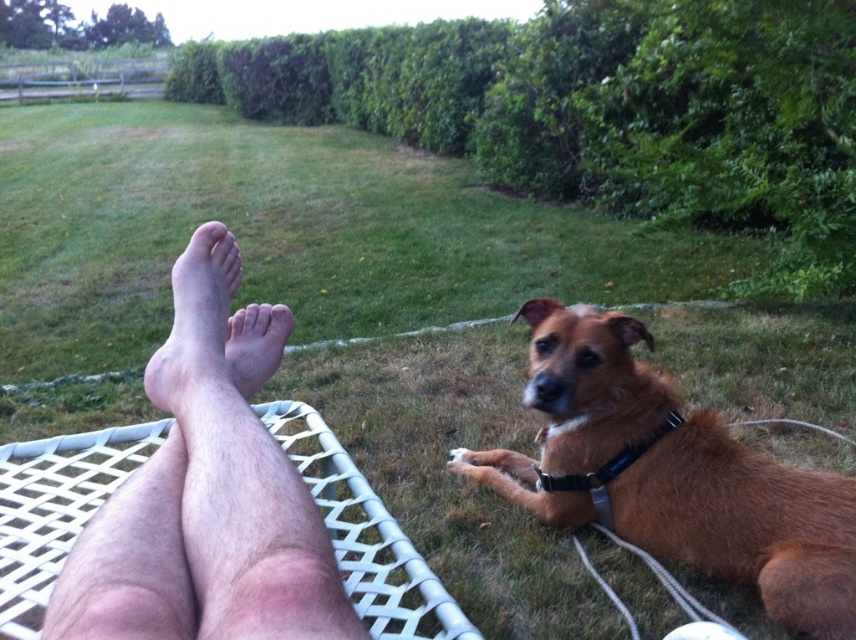
Question: Is pale skin at center to the right of smooth skin foot at center from the viewer's perspective?

Choices:
 (A) yes
 (B) no

Answer: (B)

Question: Does hair-covered skin at center come in front of pale skin at center?

Choices:
 (A) yes
 (B) no

Answer: (A)

Question: Estimate the real-world distances between objects in this image. Which object is farther from the smooth skin foot at center?

Choices:
 (A) pale skin at center
 (B) brown furry dog at lower right

Answer: (B)

Question: Which point is farther to the camera?

Choices:
 (A) pale skin at center
 (B) brown furry dog at lower right

Answer: (B)

Question: Which of the following is the closest to the observer?

Choices:
 (A) coord(301,496)
 (B) coord(223,381)
 (C) coord(535,339)

Answer: (A)

Question: Observing the image, what is the correct spatial positioning of pale skin at center in reference to smooth skin foot at center?

Choices:
 (A) above
 (B) below

Answer: (A)